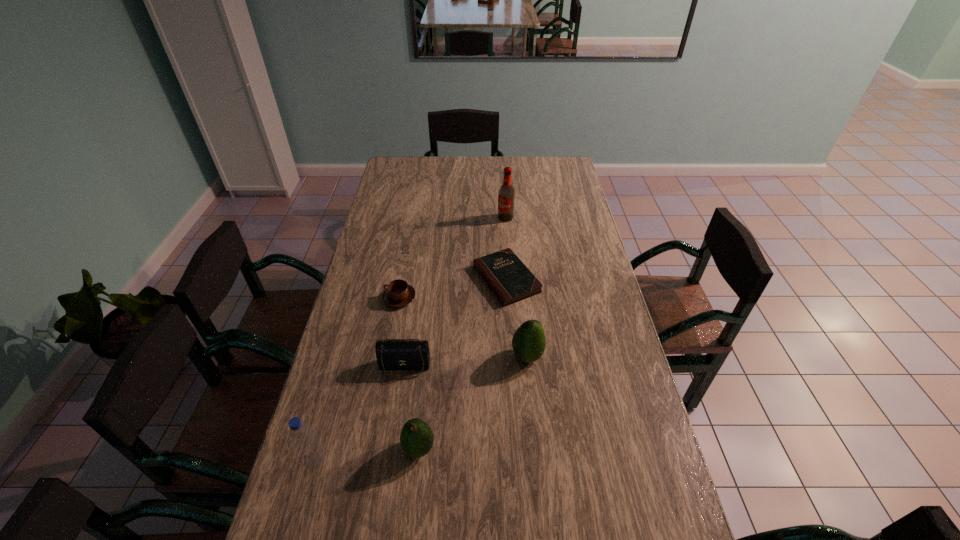
This screenshot has width=960, height=540. I want to click on free space between the clutch bag and the leftmost object, so click(360, 414).

Find the location of `free spot between the third shortest object and the tallest object`. free spot between the third shortest object and the tallest object is located at coordinates (455, 293).

Find the location of `empty space between the cappuccino and the taller avocado`. empty space between the cappuccino and the taller avocado is located at coordinates (464, 327).

Where is `free spot between the cappuccino and the right avocado`? This screenshot has width=960, height=540. free spot between the cappuccino and the right avocado is located at coordinates (464, 327).

Identify the location of unoccupied area between the Bible and the beer bottle. (506, 248).

Identify which object is the sixth closest to the third tallest object. Please provide its 2D coordinates. Your answer should be formatted as a tuple, i.e. [(x, y)], where the tuple contains the x and y coordinates of a point satisfying the conditions above.

[(506, 195)]

Identify the location of object that is the closest to the sixth tallest object. Image resolution: width=960 pixels, height=540 pixels. (392, 354).

The height and width of the screenshot is (540, 960). Identify the location of vacant space that satisfies the following two spatial constraints: 1. on the side of the cappuccino with the handle; 2. on the right side of the nearer avocado. (372, 449).

Locate an element on the screen. The image size is (960, 540). vacant region that satisfies the following two spatial constraints: 1. on the side of the cappuccino with the handle; 2. on the back side of the taller avocado is located at coordinates (389, 356).